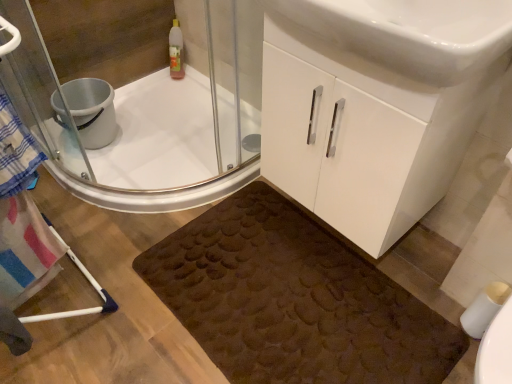
Where is `vacant space behind silver metallic bucket at upper left`? Image resolution: width=512 pixels, height=384 pixels. vacant space behind silver metallic bucket at upper left is located at coordinates (133, 104).